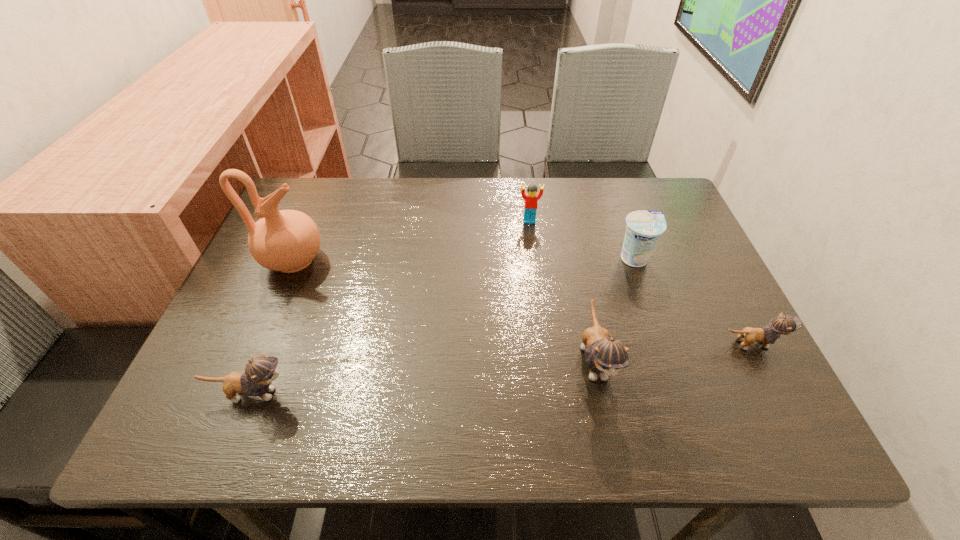
Where is `vacant point located between the yogurt and the tallest kitten`? The image size is (960, 540). vacant point located between the yogurt and the tallest kitten is located at coordinates (614, 309).

Locate an element on the screen. free area in between the pottery and the third object from left to right is located at coordinates (411, 241).

Where is `free spot between the shortest object and the tallest object`? free spot between the shortest object and the tallest object is located at coordinates (522, 302).

Locate an element on the screen. Image resolution: width=960 pixels, height=540 pixels. vacant space in between the tallest object and the shortest object is located at coordinates (522, 302).

The image size is (960, 540). I want to click on free space between the second tallest kitten and the Lego, so (391, 307).

You are a GUI agent. You are given a task and a screenshot of the screen. Output one action in this format:
    pyautogui.click(x=<x>, y=<y>)
    Task: Click on the object that is the third nearest to the leftmost kitten
    Image resolution: width=960 pixels, height=540 pixels.
    Given the screenshot: What is the action you would take?
    pyautogui.click(x=531, y=198)

Choose which object is the nearest neighbor to the tallest object. Please provide its 2D coordinates. Your answer should be formatted as a tuple, i.e. [(x, y)], where the tuple contains the x and y coordinates of a point satisfying the conditions above.

[(259, 373)]

Select which kitten is the second closest to the rightmost object. Please provide its 2D coordinates. Your answer should be formatted as a tuple, i.e. [(x, y)], where the tuple contains the x and y coordinates of a point satisfying the conditions above.

[(259, 373)]

Locate which kitten is the second closest to the rightmost kitten. Please provide its 2D coordinates. Your answer should be formatted as a tuple, i.e. [(x, y)], where the tuple contains the x and y coordinates of a point satisfying the conditions above.

[(259, 373)]

At what (x,y) coordinates should I click in order to perform the action: click on free point that satisfies the following two spatial constraints: 1. on the front side of the second object from right to left; 2. on the front-facing side of the leftmost kitten. Please return your answer as a coordinate pair (x, y). Looking at the image, I should click on (683, 394).